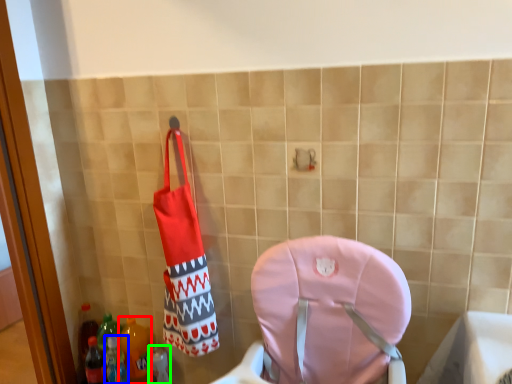
Question: Estimate the real-world distances between objects in this image. Which object is closer to bottle (highlighted by a red box), bottle (highlighted by a blue box) or bottle (highlighted by a green box)?

Choices:
 (A) bottle
 (B) bottle

Answer: (A)